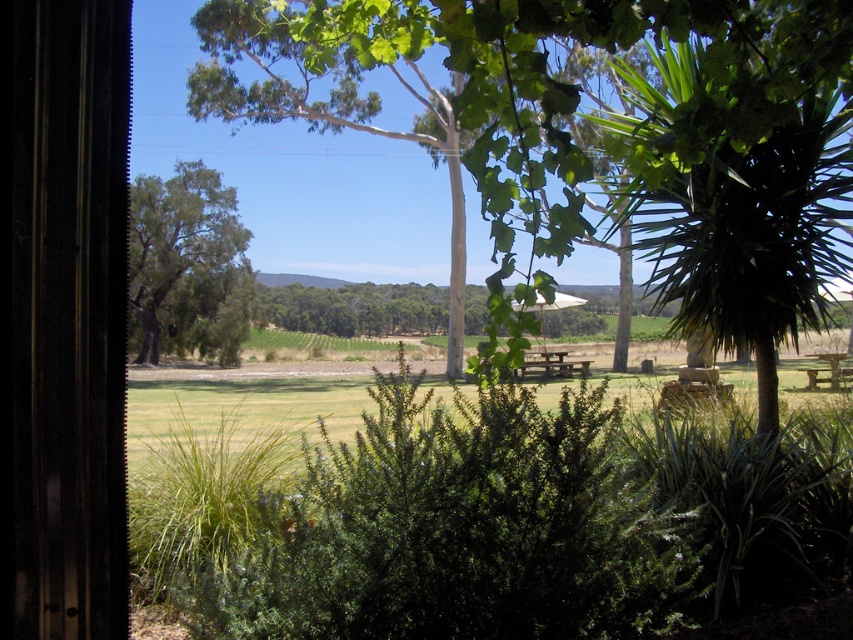
Consider the image. Does green leafy tree at center appear on the left side of green leafy tree at left?

In fact, green leafy tree at center is to the right of green leafy tree at left.

Based on the photo, between green leafy tree at center and green leafy tree at left, which one is positioned lower?

Positioned lower is green leafy tree at left.

What are the coordinates of `green leafy tree at center` in the screenshot? It's located at (607, 140).

Can you confirm if green leafy tree at center is taller than wooden picnic table at lower right?

Correct, green leafy tree at center is much taller as wooden picnic table at lower right.

Between green leafy tree at center and wooden picnic table at lower right, which one appears on the left side from the viewer's perspective?

From the viewer's perspective, green leafy tree at center appears more on the left side.

Is point (402, 6) positioned before point (825, 360)?

Yes, point (402, 6) is in front of point (825, 360).

This screenshot has height=640, width=853. What are the coordinates of `green leafy tree at center` in the screenshot? It's located at (607, 140).

Which is below, wooden picnic table at center or wooden picnic table at lower right?

wooden picnic table at center is below.

Does wooden picnic table at center have a lesser height compared to wooden picnic table at lower right?

Incorrect, wooden picnic table at center's height does not fall short of wooden picnic table at lower right's.

The height and width of the screenshot is (640, 853). What do you see at coordinates (552, 364) in the screenshot?
I see `wooden picnic table at center` at bounding box center [552, 364].

The height and width of the screenshot is (640, 853). In order to click on wooden picnic table at center in this screenshot , I will do `click(552, 364)`.